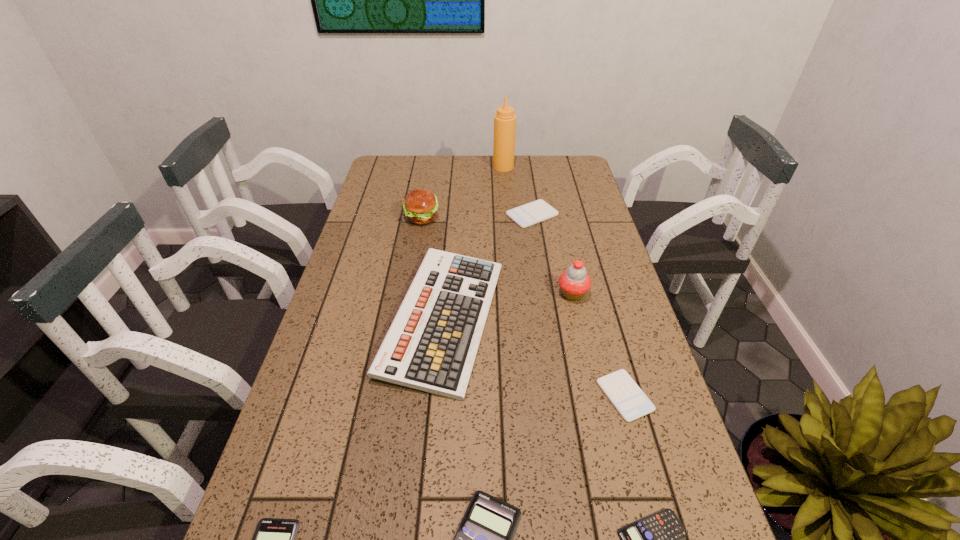
This screenshot has height=540, width=960. What are the coordinates of `blank space located on the right of the tallest object` in the screenshot? It's located at (554, 167).

In order to click on vacant point located on the left of the red cupcake in this screenshot , I will do click(532, 294).

You are a GUI agent. You are given a task and a screenshot of the screen. Output one action in this format:
    pyautogui.click(x=<x>, y=<y>)
    Task: Click on the vacant space located on the left of the hamburger
    The image size is (960, 540).
    Given the screenshot: What is the action you would take?
    pyautogui.click(x=385, y=218)

Identify the location of free space located on the front of the computer keyboard. (428, 506).

The height and width of the screenshot is (540, 960). Find the location of `vacant space located 0.360m on the left of the tallest calculator`. vacant space located 0.360m on the left of the tallest calculator is located at coordinates (401, 215).

In order to click on free region located 0.120m on the left of the nearer white calculator in this screenshot , I will do 546,396.

This screenshot has width=960, height=540. I want to click on object present at the far edge, so click(x=504, y=120).

Image resolution: width=960 pixels, height=540 pixels. I want to click on hamburger that is positioned at the left edge, so click(420, 205).

Locate an element on the screen. computer keyboard that is at the left edge is located at coordinates (431, 345).

Locate an element on the screen. Image resolution: width=960 pixels, height=540 pixels. cupcake at the right edge is located at coordinates (574, 283).